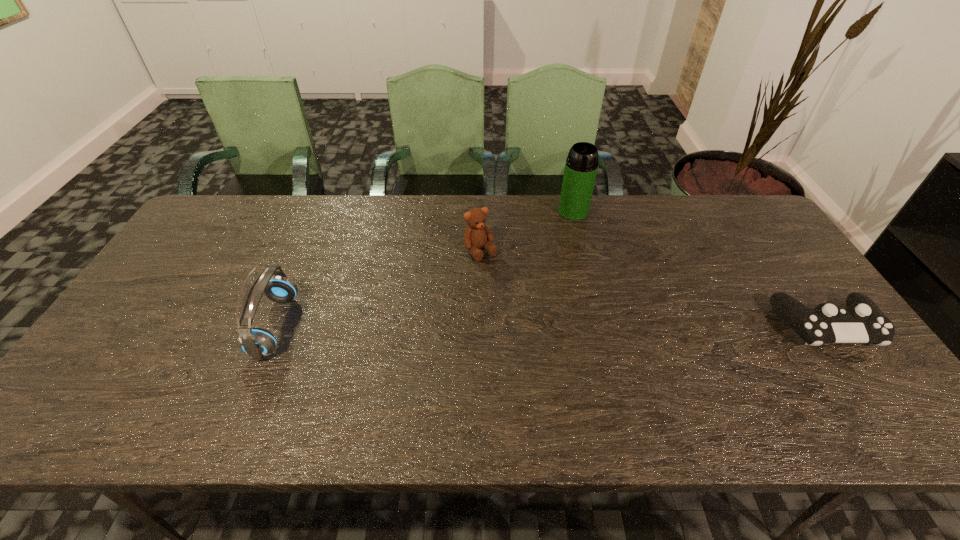
Locate an element on the screen. free space on the desktop that is between the third shortest object and the shortest object and is positioned on the face of the teddy bear is located at coordinates (537, 326).

Locate an element on the screen. free space on the desktop that is between the headset and the control and is positioned from the spout of the second object from right to left is located at coordinates (582, 326).